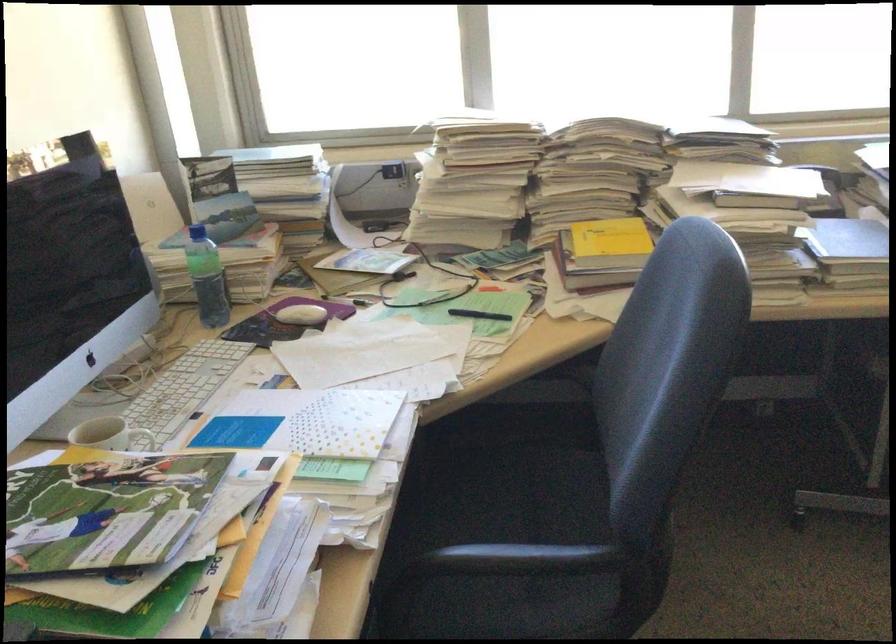
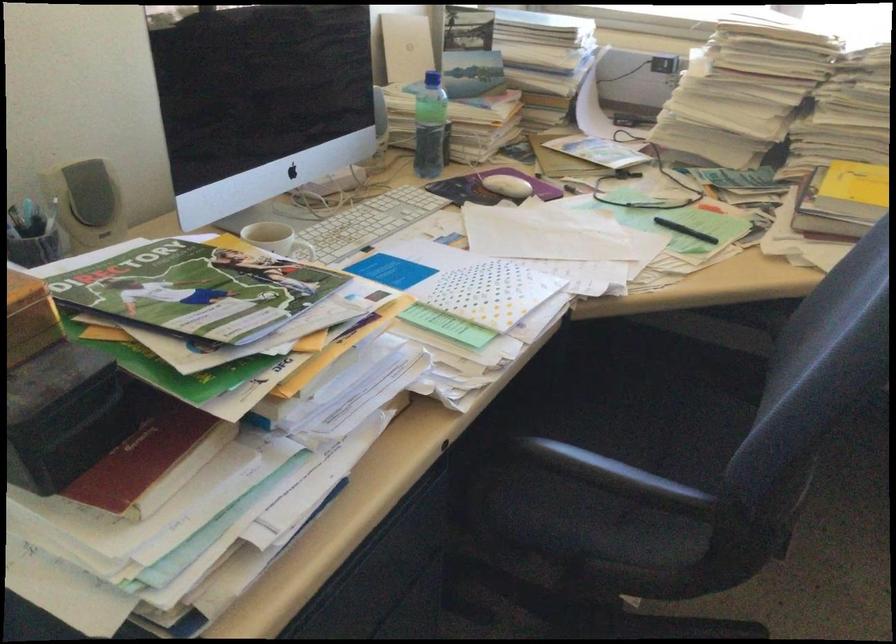
Locate, in the second image, the point that corresponds to [530,562] in the first image.

(614, 474)